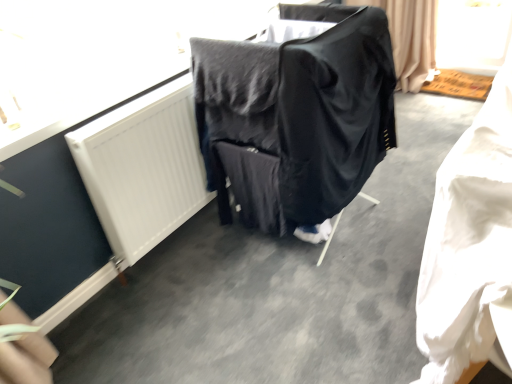
Question: Is white fabric at lower right not inside black fabric-covered chair at center?

Choices:
 (A) no
 (B) yes

Answer: (B)

Question: Can you confirm if white fabric at lower right is smaller than black fabric-covered chair at center?

Choices:
 (A) yes
 (B) no

Answer: (A)

Question: From a real-world perspective, is white fabric at lower right on top of black fabric-covered chair at center?

Choices:
 (A) yes
 (B) no

Answer: (B)

Question: Would you say black fabric-covered chair at center is part of white fabric at lower right's contents?

Choices:
 (A) yes
 (B) no

Answer: (B)

Question: Is white fabric at lower right thinner than black fabric-covered chair at center?

Choices:
 (A) yes
 (B) no

Answer: (A)

Question: From a real-world perspective, is white fabric at lower right under black fabric-covered chair at center?

Choices:
 (A) no
 (B) yes

Answer: (B)

Question: Does white matte radiator at upper left have a lesser height compared to white fabric at lower right?

Choices:
 (A) no
 (B) yes

Answer: (B)

Question: Is white matte radiator at upper left thinner than white fabric at lower right?

Choices:
 (A) no
 (B) yes

Answer: (B)

Question: Considering the relative sizes of white matte radiator at upper left and white fabric at lower right in the image provided, is white matte radiator at upper left smaller than white fabric at lower right?

Choices:
 (A) yes
 (B) no

Answer: (B)

Question: From a real-world perspective, is white matte radiator at upper left physically above white fabric at lower right?

Choices:
 (A) no
 (B) yes

Answer: (A)

Question: Is white matte radiator at upper left positioned with its back to white fabric at lower right?

Choices:
 (A) no
 (B) yes

Answer: (A)

Question: Considering the relative sizes of white matte radiator at upper left and white fabric at lower right in the image provided, is white matte radiator at upper left wider than white fabric at lower right?

Choices:
 (A) no
 (B) yes

Answer: (A)

Question: From the image's perspective, is white fabric at lower right located above white matte radiator at upper left?

Choices:
 (A) yes
 (B) no

Answer: (B)